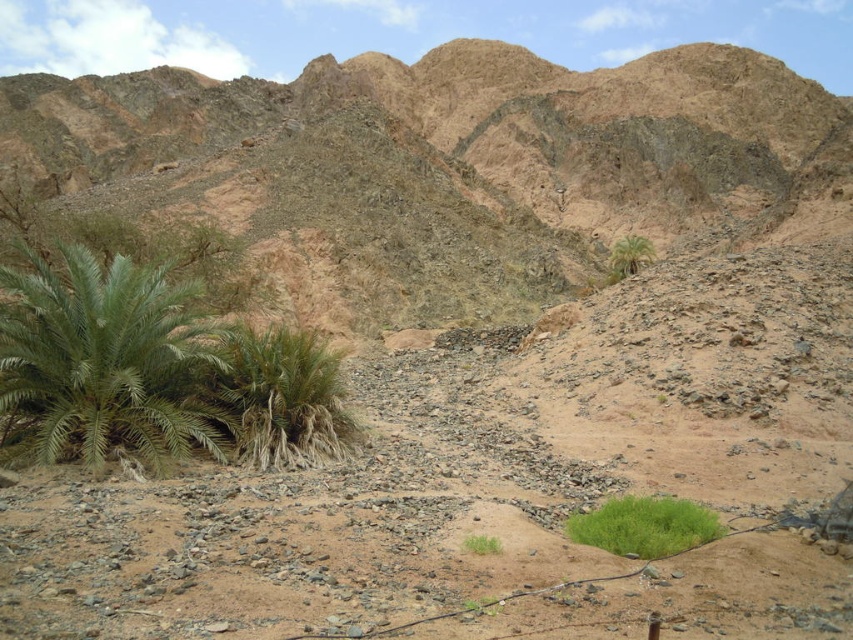
Question: Considering the relative positions of green leafy bush at center and green grass at center in the image provided, where is green leafy bush at center located with respect to green grass at center?

Choices:
 (A) above
 (B) below

Answer: (A)

Question: Is green leafy bush at center to the left of green grass at center from the viewer's perspective?

Choices:
 (A) yes
 (B) no

Answer: (B)

Question: Observing the image, what is the correct spatial positioning of green leafy palm at lower left in reference to green leafy bush at center?

Choices:
 (A) below
 (B) above

Answer: (B)

Question: Estimate the real-world distances between objects in this image. Which object is closer to the green leafy palm at lower left?

Choices:
 (A) dull brown rock at upper center
 (B) green leafy palm at center-right
 (C) green grass at center
 (D) green leafy bush at center

Answer: (C)

Question: Estimate the real-world distances between objects in this image. Which object is closer to the green grass at center?

Choices:
 (A) dull brown rock at upper center
 (B) green leafy palm at lower left
 (C) green leafy palm at center-right
 (D) green leafy bush at center

Answer: (D)

Question: Which of the following is the farthest from the observer?

Choices:
 (A) (175, 410)
 (B) (757, 58)

Answer: (B)